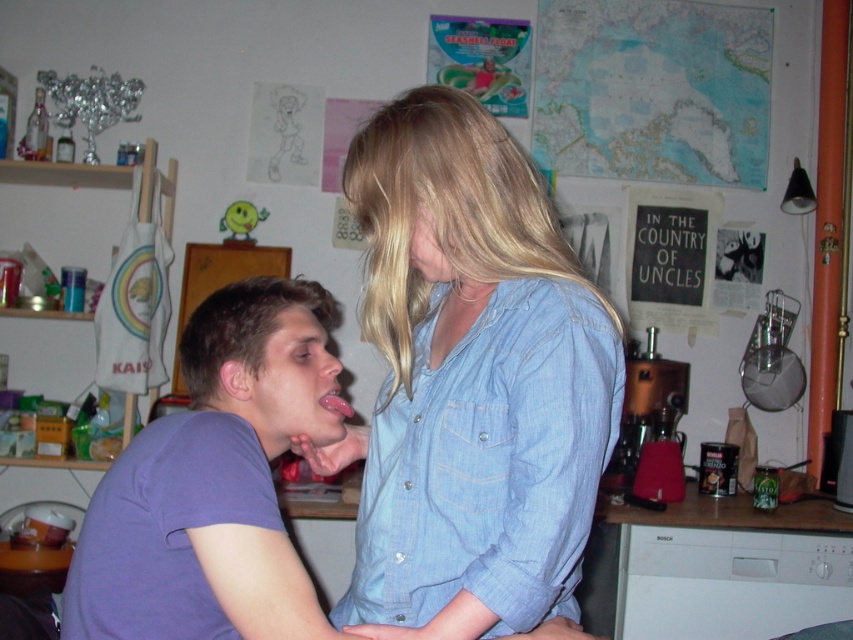
Does blue denim shirt at center come behind purple cotton t-shirt at left?

No, it is in front of purple cotton t-shirt at left.

This screenshot has width=853, height=640. I want to click on blue denim shirt at center, so click(x=471, y=381).

Where is `blue denim shirt at center`? The width and height of the screenshot is (853, 640). blue denim shirt at center is located at coordinates (471, 381).

Locate an element on the screen. The image size is (853, 640). blue denim shirt at center is located at coordinates (471, 381).